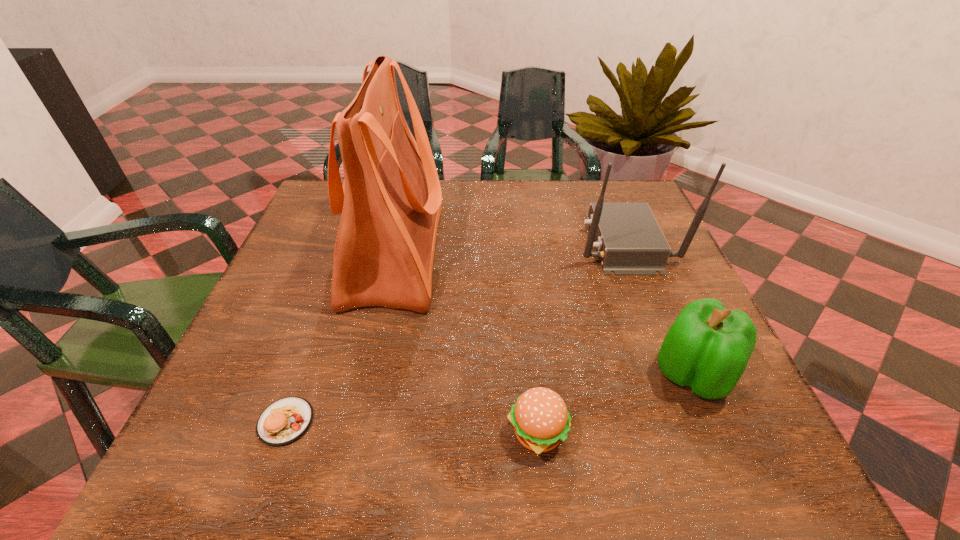
Identify the location of bell pepper at the right edge. This screenshot has width=960, height=540. (707, 348).

Identify the location of object that is at the far left corner. (390, 201).

Where is `object that is positioned at the near left corner`? object that is positioned at the near left corner is located at coordinates (286, 420).

Identify the location of object that is at the far right corner. This screenshot has width=960, height=540. (629, 241).

The height and width of the screenshot is (540, 960). In the image, there is a desktop. Identify the location of free space at the far edge. (572, 188).

Locate an element on the screen. The height and width of the screenshot is (540, 960). vacant space at the near edge is located at coordinates (311, 450).

At what (x,y) coordinates should I click in order to perform the action: click on vacant region at the left edge of the desktop. Please return your answer as a coordinate pair (x, y). The width and height of the screenshot is (960, 540). Looking at the image, I should click on (255, 360).

Where is `blank space at the right edge`? The height and width of the screenshot is (540, 960). blank space at the right edge is located at coordinates (651, 352).

In order to click on free space at the far left corner in this screenshot , I will do `click(335, 223)`.

The image size is (960, 540). I want to click on free point between the bell pepper and the fourth shortest object, so click(658, 309).